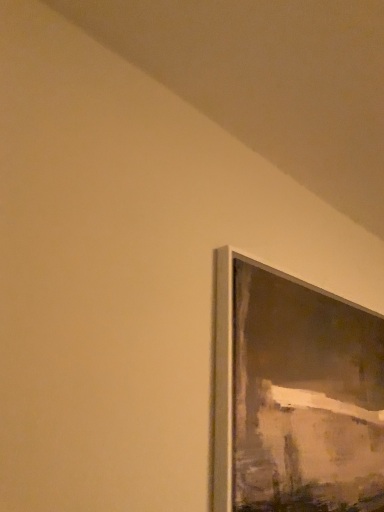
In order to face metallic silver picture frame at upper right, should I rotate leftwards or rightwards?

A 18.933 degree turn to the right will do.

Locate an element on the screen. The width and height of the screenshot is (384, 512). metallic silver picture frame at upper right is located at coordinates (294, 395).

This screenshot has height=512, width=384. Describe the element at coordinates (294, 395) in the screenshot. I see `metallic silver picture frame at upper right` at that location.

Where is `metallic silver picture frame at upper right`? Image resolution: width=384 pixels, height=512 pixels. metallic silver picture frame at upper right is located at coordinates (294, 395).